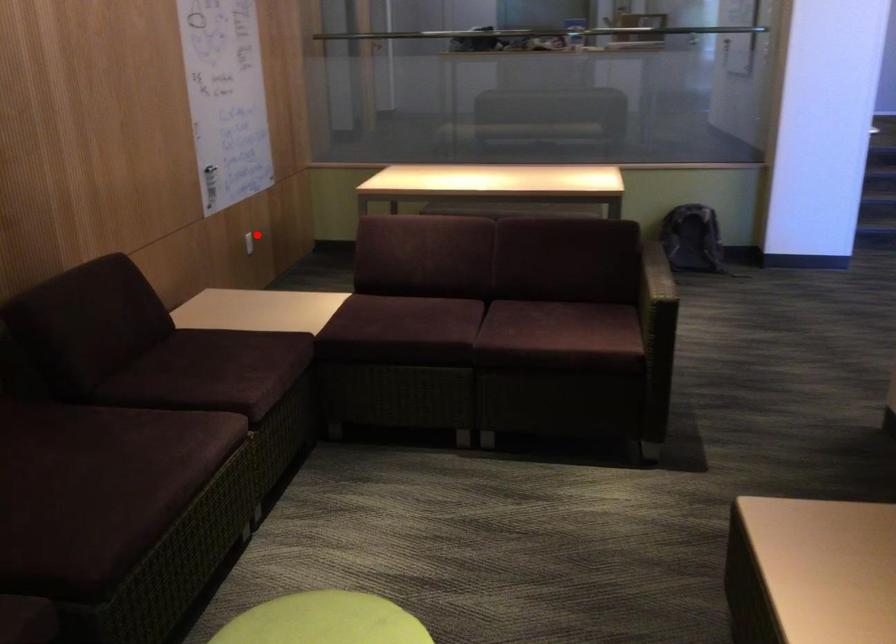
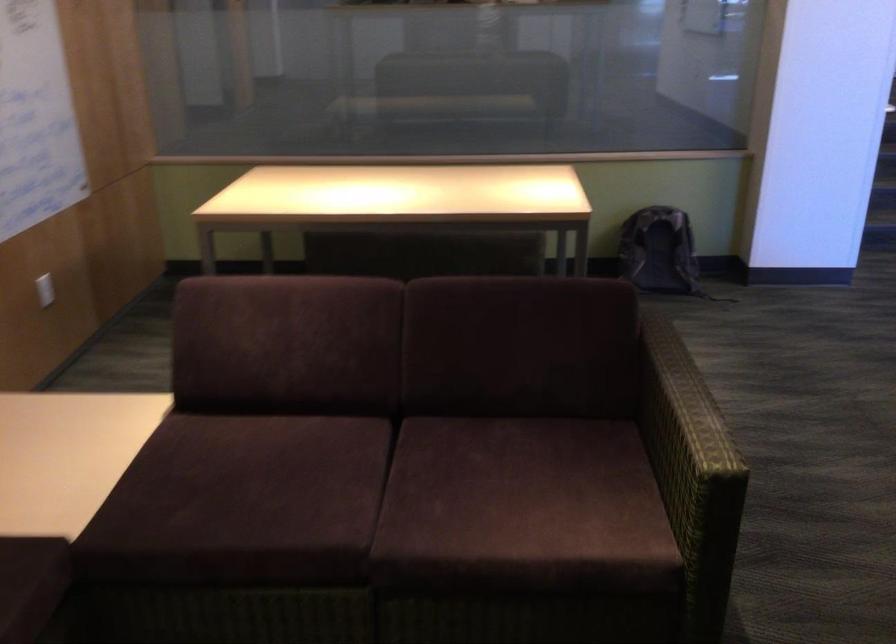
Question: I am providing you with two images of the same scene from different viewpoints. A red point is shown in image1. For the corresponding object point in image2, is it positioned nearer or farther from the camera?

Choices:
 (A) Nearer
 (B) Farther

Answer: (A)